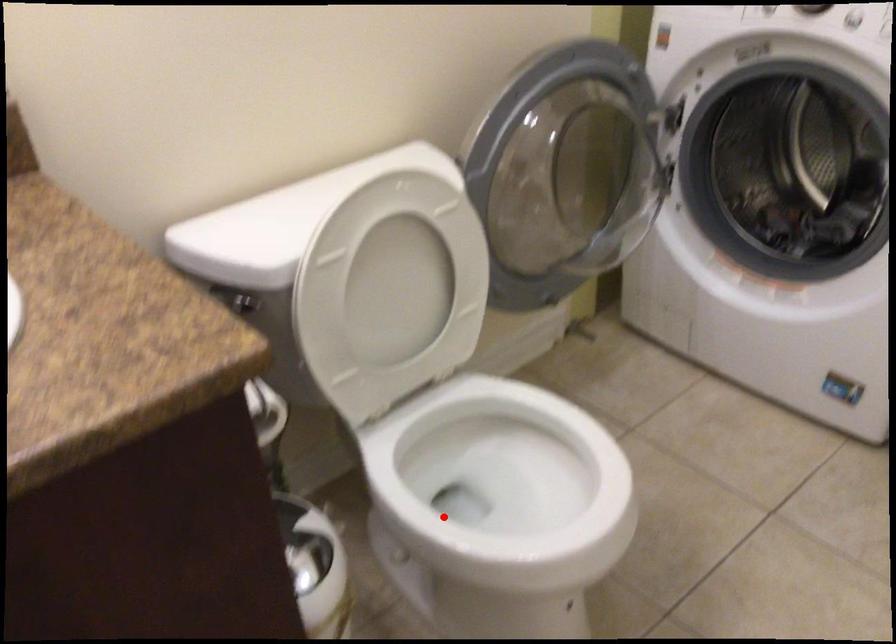
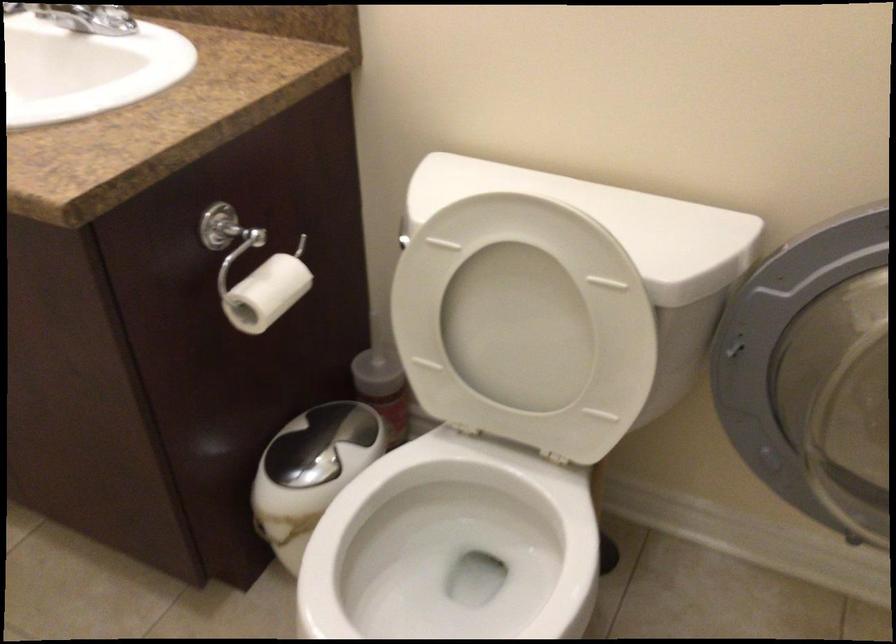
The point at the highlighted location is marked in the first image. Where is the corresponding point in the second image?

(449, 564)